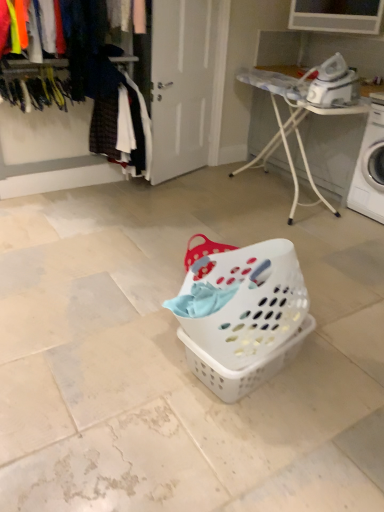
Locate an element on the screen. The image size is (384, 512). free space on the front side of white plastic laundry basket at center is located at coordinates (260, 449).